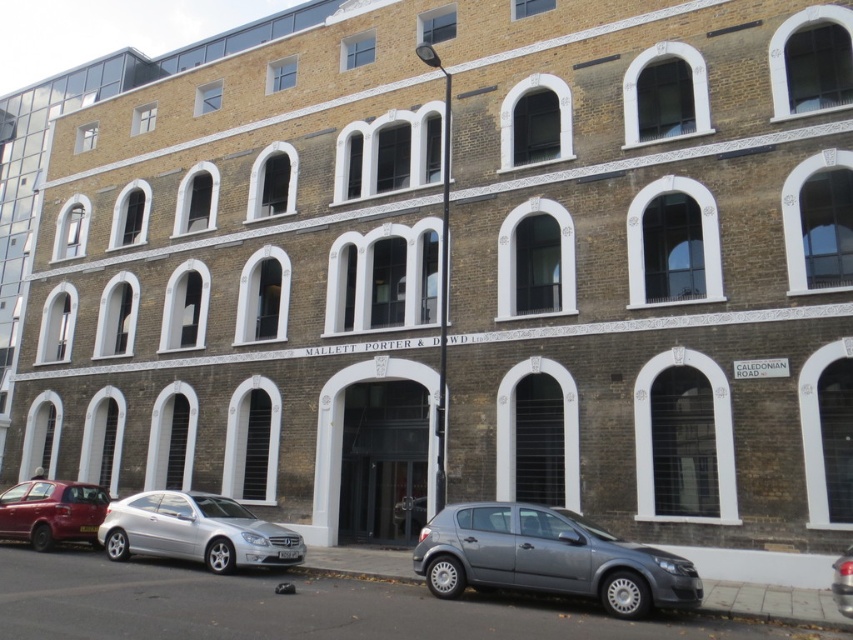
Question: Can you confirm if satin silver car at lower center is positioned to the right of silver metallic car at lower left?

Choices:
 (A) yes
 (B) no

Answer: (A)

Question: Which object appears closest to the camera in this image?

Choices:
 (A) silver metallic car at lower left
 (B) matte red car at lower left

Answer: (A)

Question: Among these points, which one is farthest from the camera?

Choices:
 (A) (88, 493)
 (B) (842, 604)
 (C) (540, 525)
 (D) (202, 524)

Answer: (A)

Question: Where is satin silver car at lower center located in relation to matte red car at lower left in the image?

Choices:
 (A) right
 (B) left

Answer: (A)

Question: Where is satin silver car at lower center located in relation to matte red car at lower left in the image?

Choices:
 (A) below
 (B) above

Answer: (B)

Question: Which point is closer to the camera?

Choices:
 (A) satin silver car at lower center
 (B) silver metallic car at lower left

Answer: (A)